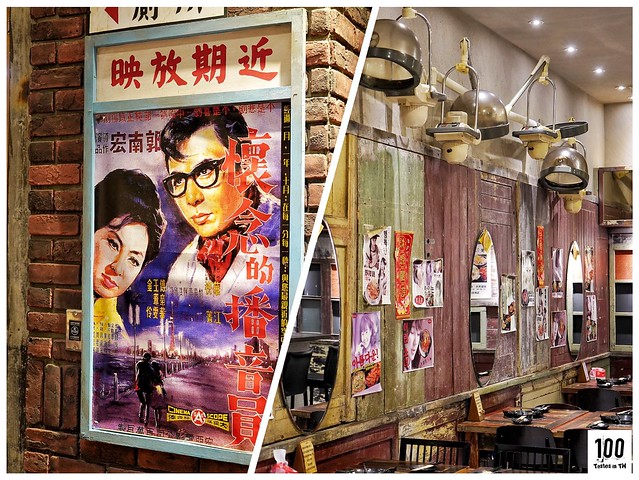
Identify the location of the 1st oval mirror. The width and height of the screenshot is (639, 480). (312, 344).